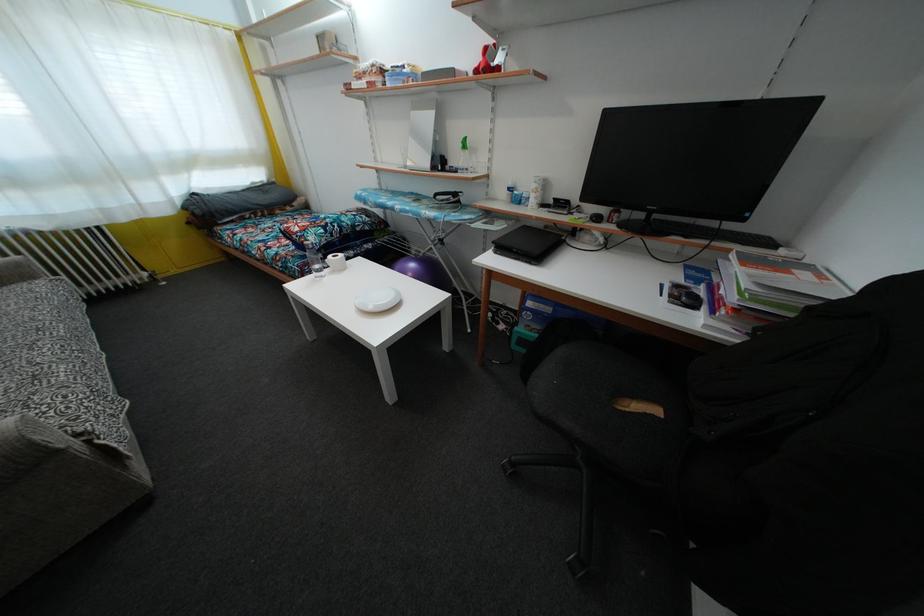
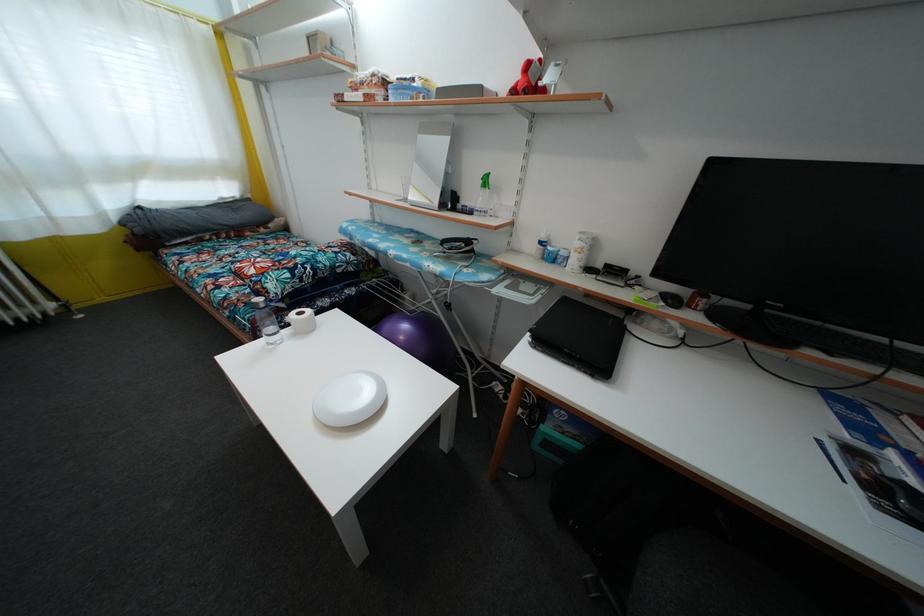
Question: The images are taken continuously from a first-person perspective. In which direction is your viewpoint rotating?

Choices:
 (A) Left
 (B) Right
 (C) Up
 (D) Down

Answer: (C)